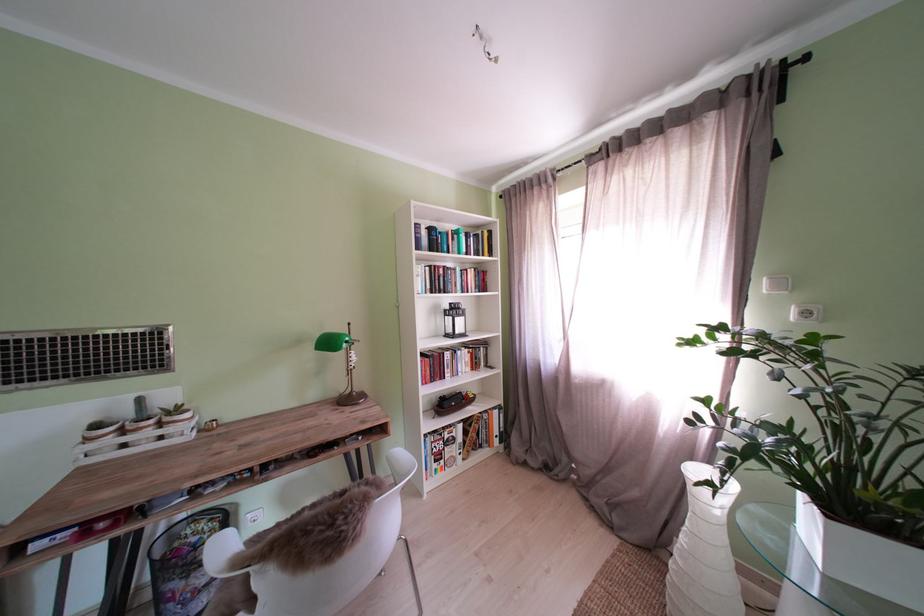
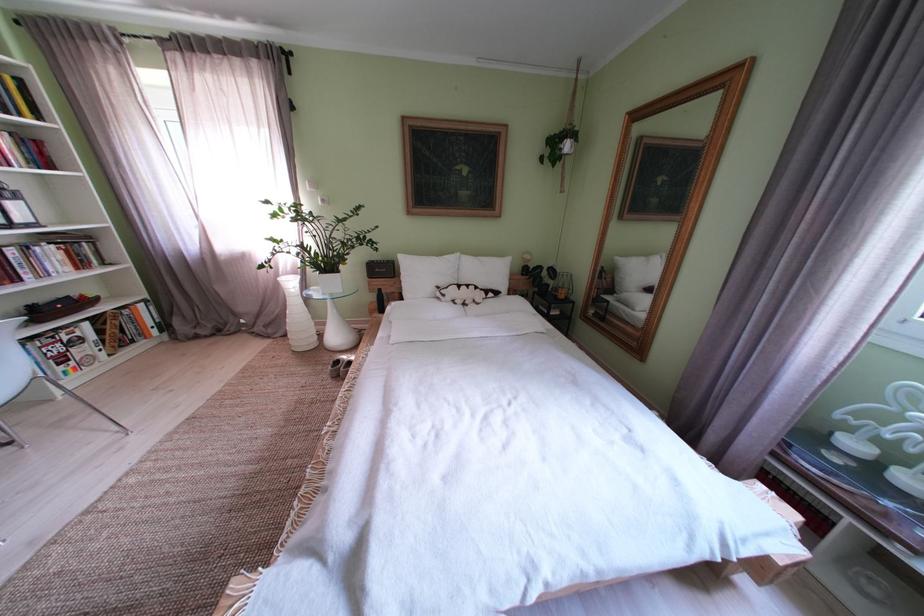
Locate, in the second image, the point that corresponds to point (478, 400) in the first image.

(92, 302)